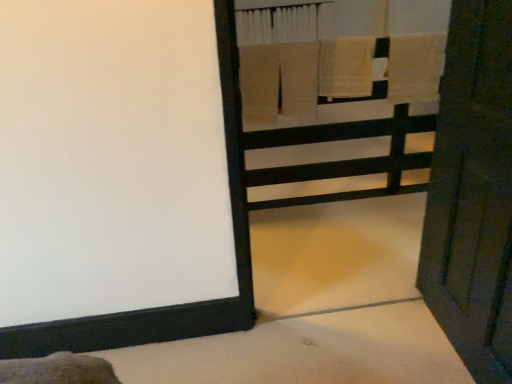
Question: Does point (373, 48) appear closer or farther from the camera than point (433, 94)?

Choices:
 (A) farther
 (B) closer

Answer: (B)

Question: Is beige cotton towel at upper center, which is the second bath towel in right-to-left order, spatially inside beige cotton towel at upper right, the 2th bath towel positioned from the left, or outside of it?

Choices:
 (A) inside
 (B) outside

Answer: (B)

Question: Which of these objects is positioned closest to the beige cotton towel at upper center, which is the second bath towel in right-to-left order?

Choices:
 (A) wooden bunk bed at upper right
 (B) beige cotton towel at upper right, the 1th bath towel in the right-to-left sequence
 (C) wooden door at right

Answer: (B)

Question: Estimate the real-world distances between objects in this image. Which object is closer to the beige cotton towel at upper right, the 2th bath towel positioned from the left?

Choices:
 (A) wooden bunk bed at upper right
 (B) wooden door at right
 (C) beige cotton towel at upper center, which is the second bath towel in right-to-left order

Answer: (C)